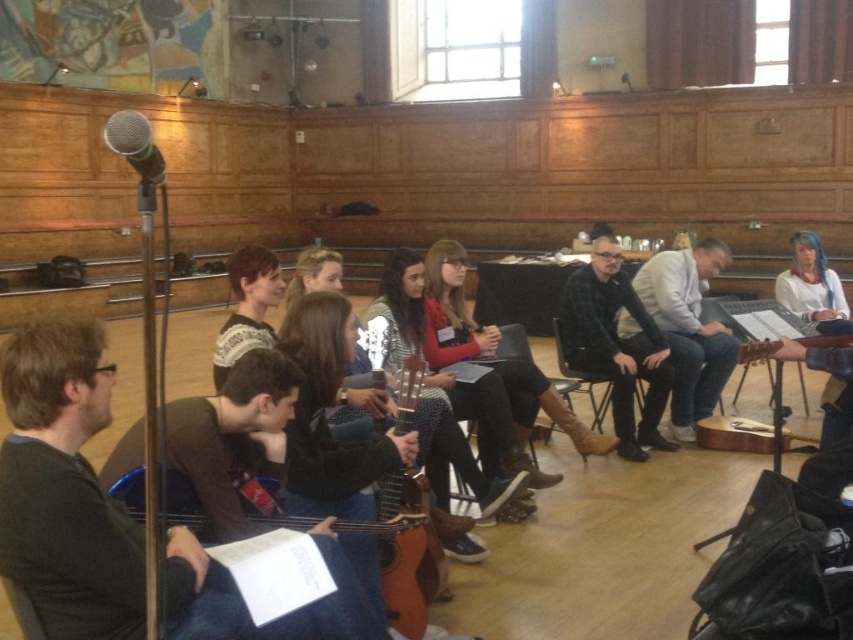
You are a photographer setting up for a group photo in the music room. You need to place two markers at the exact locations of point (583, 364) and point (389, 529). Since you can only place one marker at a time, which point should you place first to ensure the closest one is visible in the photo?

You should place the marker at point (389, 529) first because it is closer to the viewer than point (583, 364), ensuring it is visible before placing the other marker.

You are a photographer setting up for a group photo in the music room. You have a camera with a 30cm focal length lens. The plaid fabric shirt at center and the silver metallic microphone at upper left are both in your frame. Which object will appear larger in the photo?

The plaid fabric shirt at center will appear larger in the photo because it is larger in size than the silver metallic microphone at upper left.

You are a photographer standing in the music room. You want to take a closeup photo of the acoustic wood guitar at lower left without the camera appearing in the reflection of the polished floor. The camera is 1.88 meters away from the guitar. Is the distance sufficient to avoid the reflection?

The acoustic wood guitar at lower left and camera are 1.88 meters apart from each other. Since the camera is positioned 1.88 meters away from the guitar, this distance should be sufficient to prevent the camera from appearing in the guitar reflection on the polished floor.